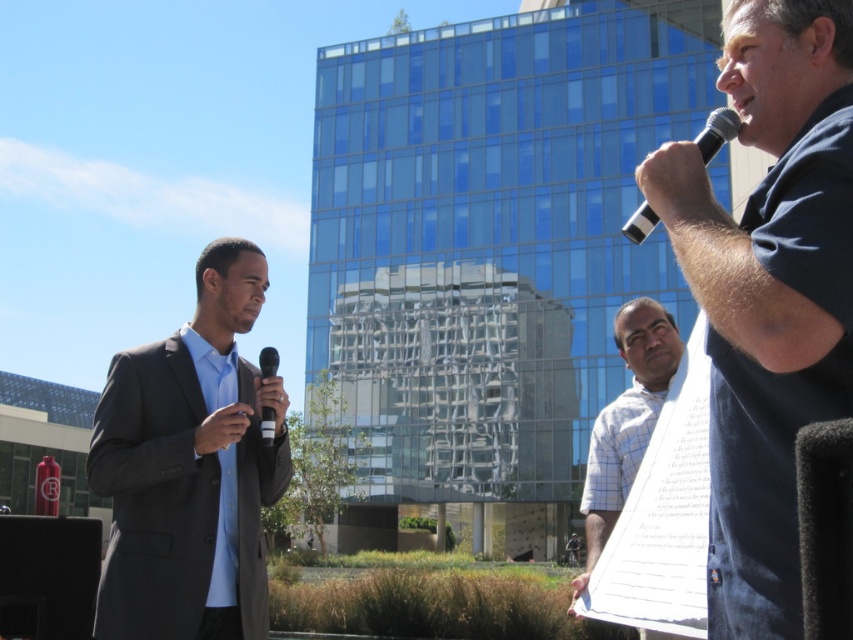
You are a photographer at the event and want to capture a photo of the white checkered shirt at center and the black plastic microphone at upper right. Which object will appear smaller in the photo?

The white checkered shirt at center is shorter than the black plastic microphone at upper right, so the white checkered shirt at center will appear smaller in the photo.

You are attending a public speaking event and see the white checkered shirt at center and the black plastic microphone at upper right. Which object is positioned more to the right side of the scene?

The black plastic microphone at upper right is positioned more to the right side of the scene than the white checkered shirt at center.

You are at an event and want to grab the microphone. The point at coordinates (47,577) is part of an object. Which object is it located on?

The point at coordinates (47,577) is located on the matte black microphone at lower left.